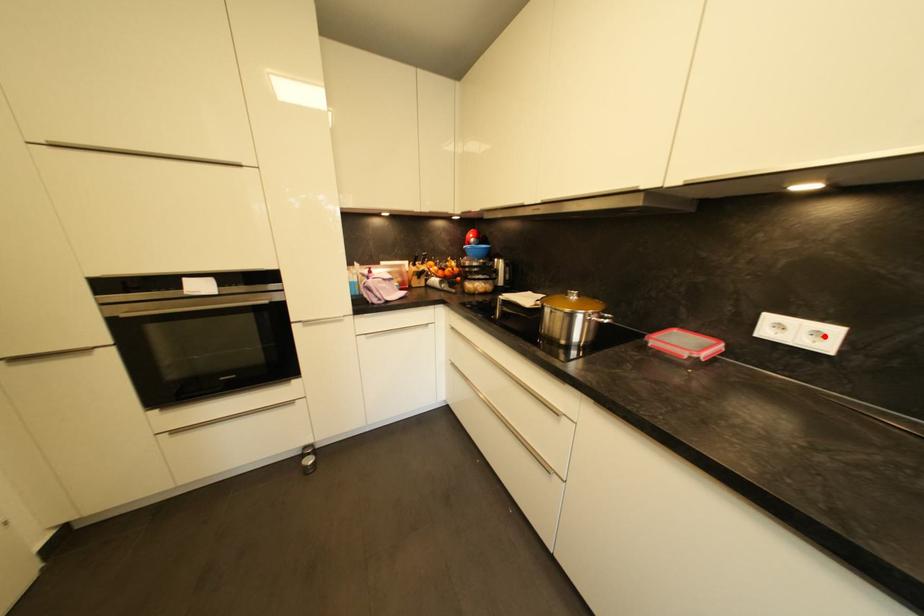
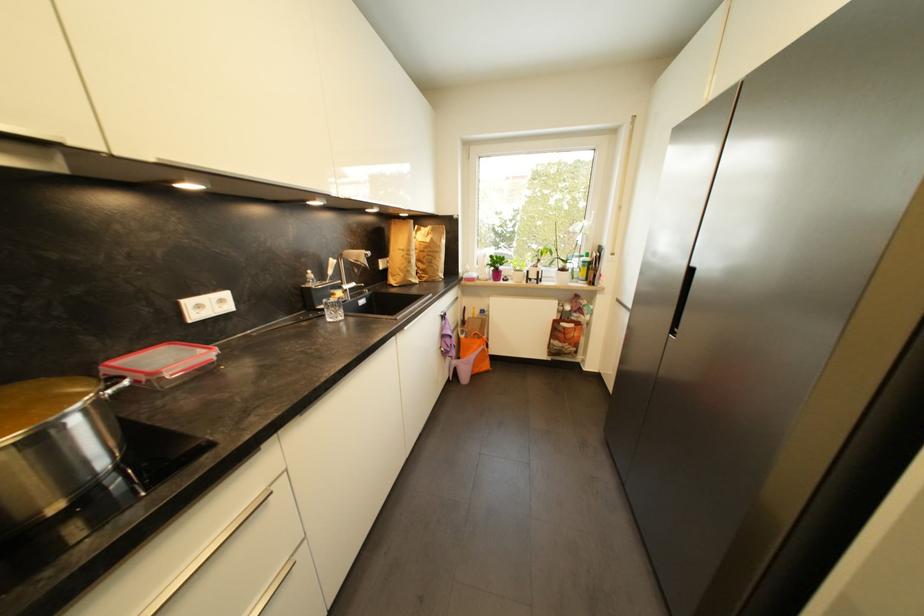
Find the pixel in the second image that matches the highlighted location in the first image.

(226, 302)